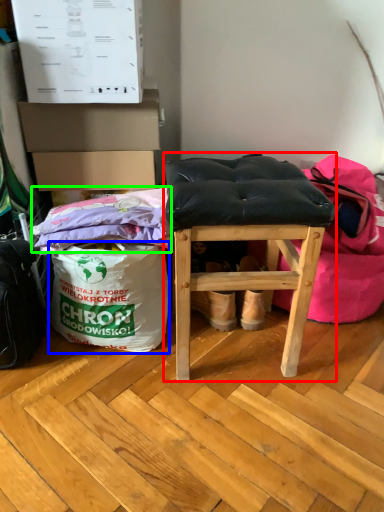
Question: Estimate the real-world distances between objects in this image. Which object is farther from furniture (highlighted by a red box), grocery bag (highlighted by a blue box) or material (highlighted by a green box)?

Choices:
 (A) grocery bag
 (B) material

Answer: (A)